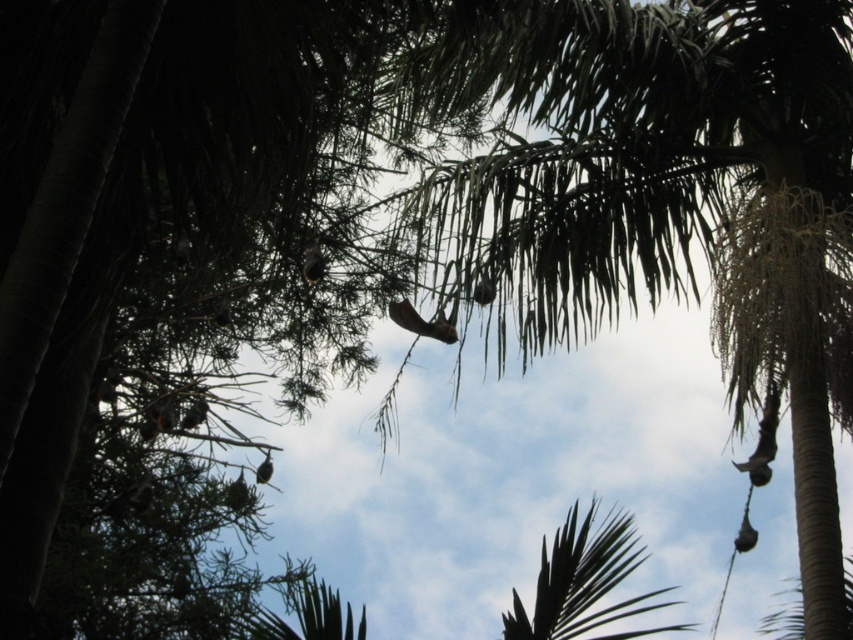
Between green leafy palm tree at upper center and green leafy palm at center, which one is positioned higher?

Positioned higher is green leafy palm tree at upper center.

Looking at this image, measure the distance between green leafy palm tree at upper center and camera.

green leafy palm tree at upper center is 4.06 meters from camera.

The height and width of the screenshot is (640, 853). Identify the location of green leafy palm tree at upper center. (660, 195).